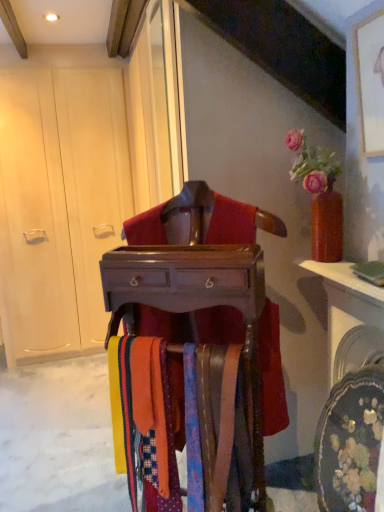
Describe the element at coordinates (192, 290) in the screenshot. I see `wooden chest at center` at that location.

The width and height of the screenshot is (384, 512). In order to click on wooden chest at center in this screenshot , I will do `click(192, 290)`.

The height and width of the screenshot is (512, 384). Describe the element at coordinates (60, 203) in the screenshot. I see `matte white armoire at left` at that location.

The width and height of the screenshot is (384, 512). I want to click on matte white armoire at left, so click(60, 203).

The height and width of the screenshot is (512, 384). Identify the location of wooden chest at center. (192, 290).

Between wooden chest at center and matte white armoire at left, which one appears on the left side from the viewer's perspective?

From the viewer's perspective, matte white armoire at left appears more on the left side.

Who is more distant, wooden chest at center or matte white armoire at left?

Positioned behind is matte white armoire at left.

Between point (194, 229) and point (107, 249), which one is positioned in front?

The point (194, 229) is more forward.

From the image's perspective, does wooden chest at center appear lower than matte white armoire at left?

Yes, from the image's perspective, wooden chest at center is below matte white armoire at left.

From a real-world perspective, is wooden chest at center physically located above or below matte white armoire at left?

In terms of real-world spatial position, wooden chest at center is below matte white armoire at left.

Which object is thinner, wooden chest at center or matte white armoire at left?

Answer: wooden chest at center is thinner.

Which of these two, wooden chest at center or matte white armoire at left, stands shorter?

wooden chest at center.

Can you confirm if wooden chest at center is smaller than matte white armoire at left?

Yes.

Is wooden chest at center not inside matte white armoire at left?

Yes, wooden chest at center is located beyond the bounds of matte white armoire at left.

Looking at this image, are wooden chest at center and matte white armoire at left beside each other?

No, wooden chest at center is not in contact with matte white armoire at left.

Is wooden chest at center facing away from matte white armoire at left?

That's not correct — wooden chest at center is not looking away from matte white armoire at left.

You are a GUI agent. You are given a task and a screenshot of the screen. Output one action in this format:
    pyautogui.click(x=<x>, y=<y>)
    Task: Click on the armoire positioned vertically above the wooden chest at center (from a real-world perspective)
    The height and width of the screenshot is (512, 384).
    Given the screenshot: What is the action you would take?
    pyautogui.click(x=60, y=203)

In the image, is matte white armoire at left on the left side or the right side of wooden chest at center?

In the image, matte white armoire at left appears on the left side of wooden chest at center.

Considering the positions of objects matte white armoire at left and wooden chest at center in the image provided, who is behind, matte white armoire at left or wooden chest at center?

matte white armoire at left is behind.

Which is in front, point (6, 141) or point (174, 254)?

The point (174, 254) is closer.

From the image's perspective, who appears lower, matte white armoire at left or wooden chest at center?

wooden chest at center, from the image's perspective.

From a real-world perspective, is matte white armoire at left above or below wooden chest at center?

In terms of real-world spatial position, matte white armoire at left is above wooden chest at center.

Looking at this image, which object is wider, matte white armoire at left or wooden chest at center?

With larger width is matte white armoire at left.

Considering the relative sizes of matte white armoire at left and wooden chest at center in the image provided, is matte white armoire at left shorter than wooden chest at center?

In fact, matte white armoire at left may be taller than wooden chest at center.

Considering the sizes of objects matte white armoire at left and wooden chest at center in the image provided, who is bigger, matte white armoire at left or wooden chest at center?

With larger size is matte white armoire at left.

Would you say matte white armoire at left is outside wooden chest at center?

matte white armoire at left lies outside wooden chest at center's area.

Is the surface of matte white armoire at left in direct contact with wooden chest at center?

No.

Consider the image. Could you tell me if matte white armoire at left is facing wooden chest at center?

Yes, matte white armoire at left is oriented towards wooden chest at center.

The width and height of the screenshot is (384, 512). I want to click on furniture located underneath the matte white armoire at left (from a real-world perspective), so click(x=192, y=290).

Where is `furniture lying below the matte white armoire at left (from the image's perspective)`? furniture lying below the matte white armoire at left (from the image's perspective) is located at coordinates point(192,290).

In order to click on furniture in front of the matte white armoire at left in this screenshot , I will do `click(192, 290)`.